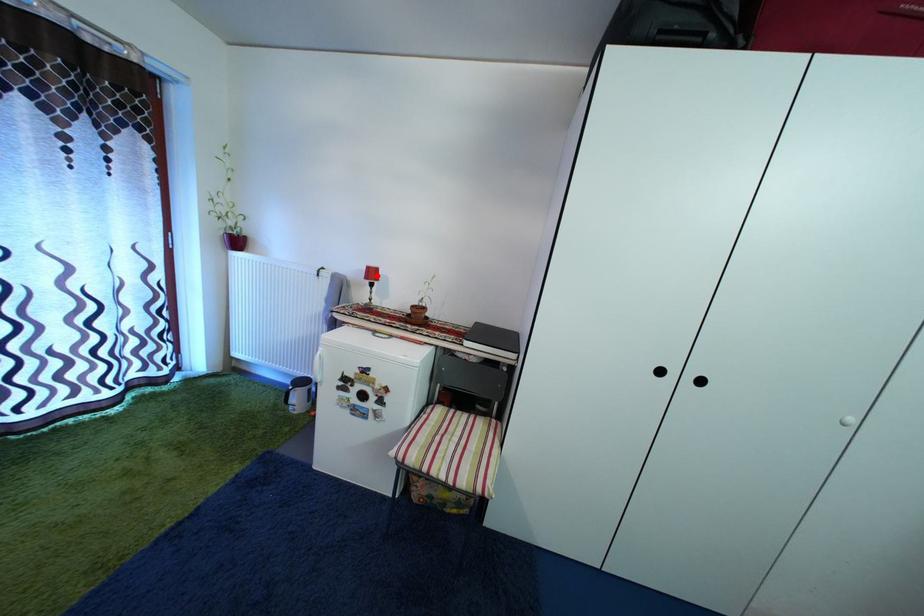
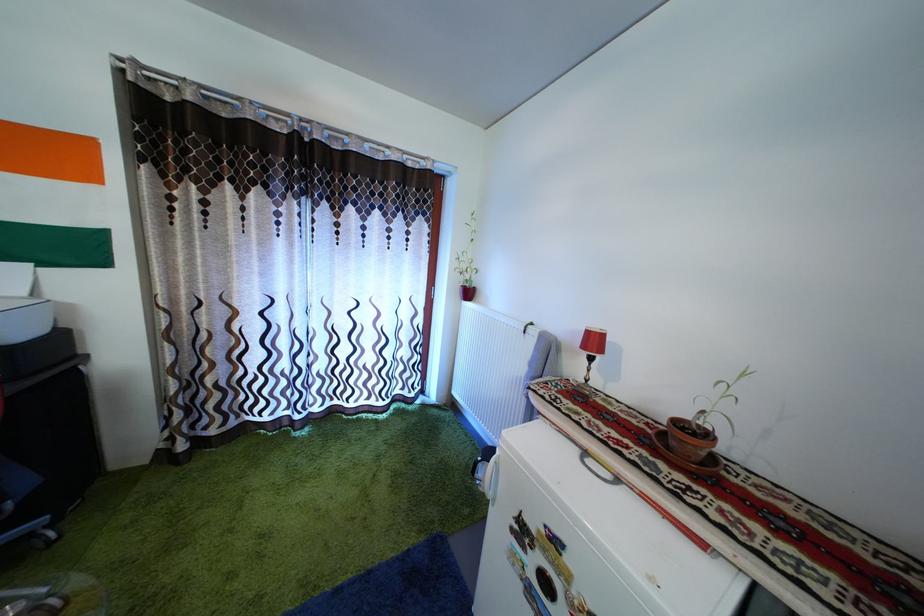
Where in the second image is the point corresponding to the highlighted location from the first image?

(598, 339)